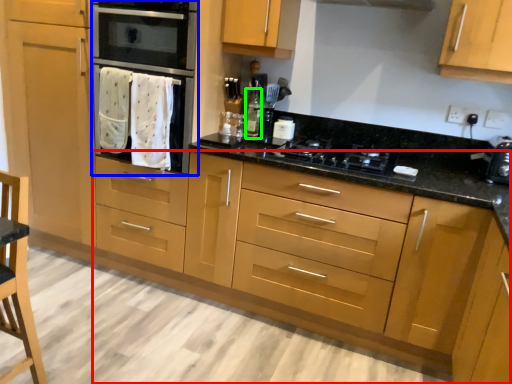
Question: Based on their relative distances, which object is farther from cabinetry (highlighted by a red box)? Choose from oven (highlighted by a blue box) and bottle (highlighted by a green box).

Choices:
 (A) oven
 (B) bottle

Answer: (B)